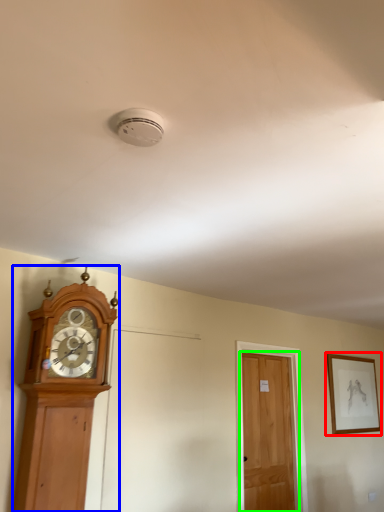
Question: Which is nearer to the picture frame (highlighted by a red box)? wall clock (highlighted by a blue box) or door (highlighted by a green box).

Choices:
 (A) wall clock
 (B) door

Answer: (B)